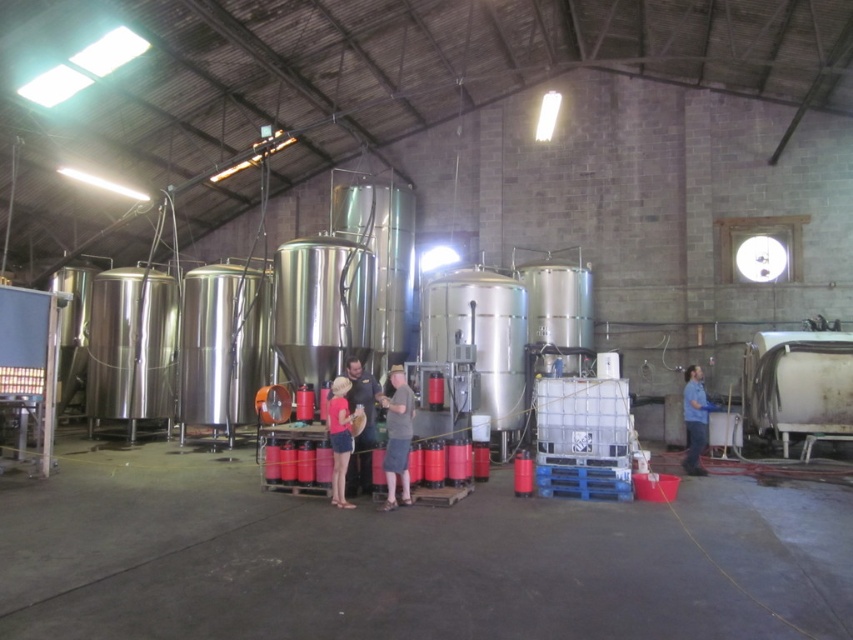
Is matte red shirt at center positioned at the back of blue fabric shirt at right?

No, matte red shirt at center is closer to the viewer.

Which is in front, point (358, 412) or point (704, 436)?

Point (358, 412)

This screenshot has height=640, width=853. Find the location of `matte red shirt at center`. matte red shirt at center is located at coordinates (340, 436).

Measure the distance between gray cotton t-shirt at center and blue fabric shirt at right.

5.02 meters

Is point (387, 435) in front of point (701, 424)?

Yes, point (387, 435) is in front of point (701, 424).

You are a GUI agent. You are given a task and a screenshot of the screen. Output one action in this format:
    pyautogui.click(x=<x>, y=<y>)
    Task: Click on the gray cotton t-shirt at center
    The image size is (853, 640).
    Given the screenshot: What is the action you would take?
    pyautogui.click(x=397, y=436)

Between point (369, 426) and point (349, 442), which one is positioned in front?

Positioned in front is point (349, 442).

Looking at this image, does matte black shirt at center have a greater height compared to matte red shirt at center?

Correct, matte black shirt at center is much taller as matte red shirt at center.

The width and height of the screenshot is (853, 640). What do you see at coordinates (363, 428) in the screenshot?
I see `matte black shirt at center` at bounding box center [363, 428].

Identify the location of matte black shirt at center. Image resolution: width=853 pixels, height=640 pixels. (363, 428).